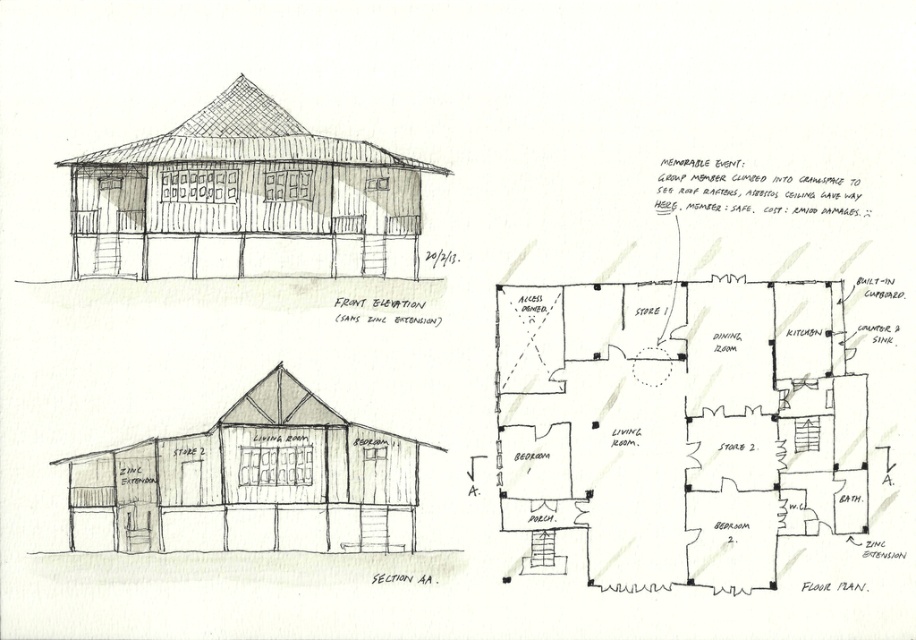
Based on the architectural sketch, which of the two points, point 1 at coordinates (x=341, y=148) or point 2 at (x=380, y=516), is closer to the viewer in the front elevation drawing?

Point 1 at coordinates (x=341, y=148) is closer to the viewer in the front elevation drawing because it is in front of point 2 at (x=380, y=516).